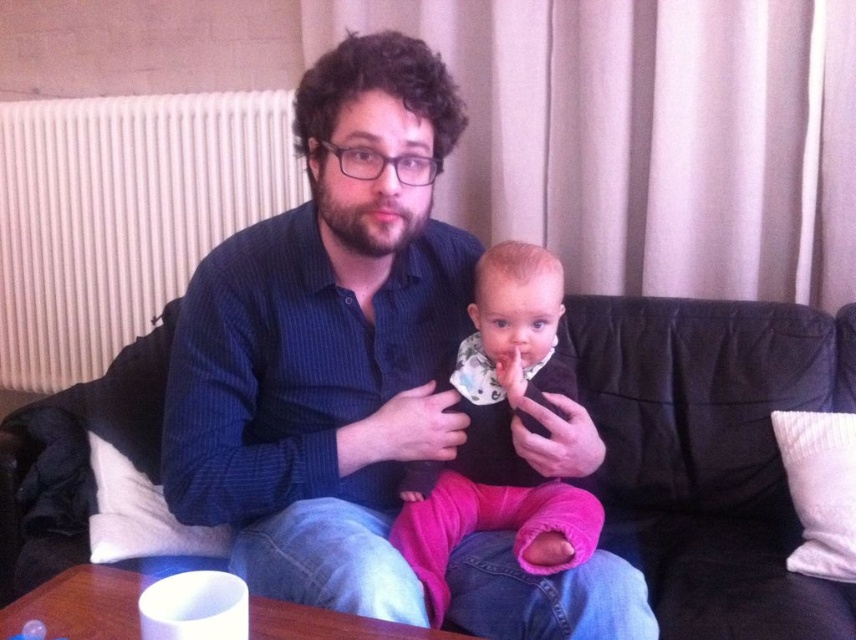
Question: Does blue striped shirt at center appear on the right side of pink fleece pants at center?

Choices:
 (A) yes
 (B) no

Answer: (B)

Question: Is blue striped shirt at center wider than black leather couch at center?

Choices:
 (A) no
 (B) yes

Answer: (B)

Question: Which object is closer to the camera taking this photo?

Choices:
 (A) pink fleece pants at center
 (B) black leather couch at center
 (C) blue striped shirt at center

Answer: (C)

Question: Estimate the real-world distances between objects in this image. Which object is closer to the black leather couch at center?

Choices:
 (A) pink fleece pants at center
 (B) blue striped shirt at center

Answer: (A)

Question: Can you confirm if blue striped shirt at center is bigger than black leather couch at center?

Choices:
 (A) yes
 (B) no

Answer: (A)

Question: Among these objects, which one is farthest from the camera?

Choices:
 (A) blue striped shirt at center
 (B) pink fleece pants at center
 (C) black leather couch at center

Answer: (C)